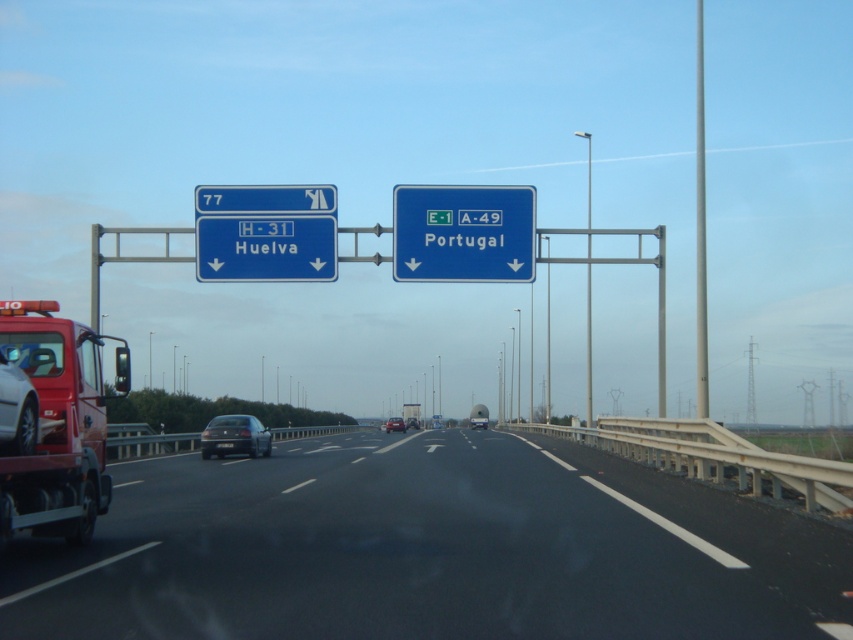
Question: Is blue metallic sign at upper center positioned behind shiny black sedan at center?

Choices:
 (A) no
 (B) yes

Answer: (A)

Question: Which of the following is the farthest from the observer?

Choices:
 (A) (276, 538)
 (B) (410, 403)
 (C) (221, 445)

Answer: (B)

Question: Which point is farther to the camera?

Choices:
 (A) (204, 456)
 (B) (408, 412)

Answer: (B)

Question: Is black asphalt highway at center thinner than metallic silver truck at center?

Choices:
 (A) yes
 (B) no

Answer: (B)

Question: Estimate the real-world distances between objects in this image. Which object is farther from the blue metallic sign at center?

Choices:
 (A) blue plastic road sign at upper center
 (B) black asphalt highway at center
 (C) metallic silver truck at center
 (D) red matte fire truck at left

Answer: (C)

Question: Observing the image, what is the correct spatial positioning of blue plastic road sign at upper center in reference to matte red sedan at center?

Choices:
 (A) left
 (B) right

Answer: (A)